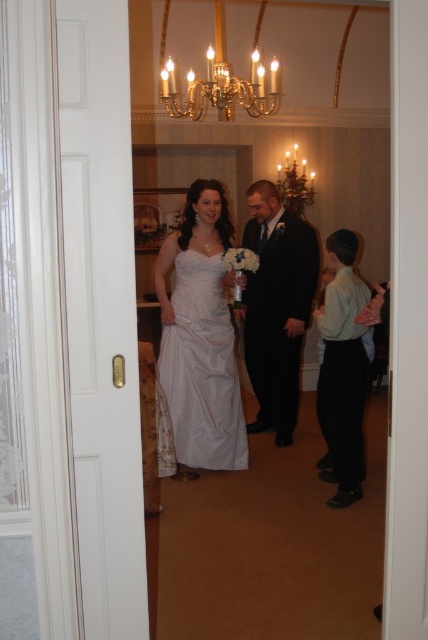
Question: Estimate the real-world distances between objects in this image. Which object is farther from the black satin suit at center?

Choices:
 (A) white satin dress at center
 (B) black satin suit at right

Answer: (B)

Question: Estimate the real-world distances between objects in this image. Which object is closer to the black satin suit at center?

Choices:
 (A) black satin suit at right
 (B) white satin dress at center

Answer: (B)

Question: Which of the following is the farthest from the observer?

Choices:
 (A) white satin dress at center
 (B) black satin suit at center
 (C) black satin suit at right

Answer: (B)

Question: Observing the image, what is the correct spatial positioning of black satin suit at center in reference to black satin suit at right?

Choices:
 (A) left
 (B) right

Answer: (A)

Question: Is white satin dress at center positioned in front of black satin suit at right?

Choices:
 (A) no
 (B) yes

Answer: (A)

Question: Is white satin dress at center positioned in front of black satin suit at right?

Choices:
 (A) yes
 (B) no

Answer: (B)